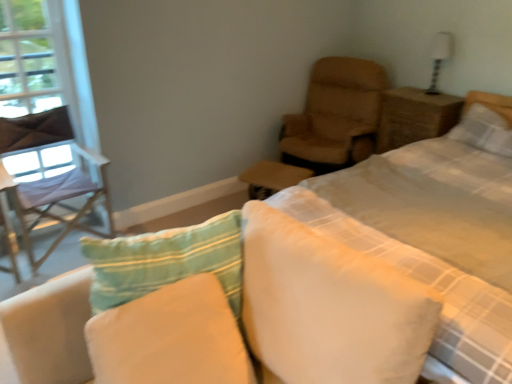
Question: Can leather-like tan chair at upper right, the first chair in the right-to-left sequence, be found inside soft cotton pillow at center, the third pillow when ordered from top to bottom?

Choices:
 (A) no
 (B) yes

Answer: (A)

Question: Is soft cotton pillow at center, which ranks as the first pillow in front-to-back order, positioned before leather-like tan chair at upper right, the second chair in the left-to-right sequence?

Choices:
 (A) no
 (B) yes

Answer: (B)

Question: Does soft cotton pillow at center, which is the 3th pillow from right to left, have a lesser height compared to leather-like tan chair at upper right, the second chair in the left-to-right sequence?

Choices:
 (A) yes
 (B) no

Answer: (A)

Question: Does soft cotton pillow at center, which ranks as the first pillow in front-to-back order, appear on the left side of leather-like tan chair at upper right, the first chair in the right-to-left sequence?

Choices:
 (A) yes
 (B) no

Answer: (A)

Question: From a real-world perspective, is soft cotton pillow at center, the third pillow when ordered from top to bottom, below leather-like tan chair at upper right, the second chair in the left-to-right sequence?

Choices:
 (A) no
 (B) yes

Answer: (B)

Question: Is white textured pillow at upper right, the 1th pillow in the back-to-front sequence, bigger or smaller than white soft pillow at center, the 2th pillow from the back?

Choices:
 (A) small
 (B) big

Answer: (A)

Question: Is white textured pillow at upper right, the 1th pillow in the back-to-front sequence, in front of or behind white soft pillow at center, which ranks as the 2th pillow in bottom-to-top order, in the image?

Choices:
 (A) front
 (B) behind

Answer: (B)

Question: In the image, is white textured pillow at upper right, placed as the third pillow when sorted from left to right, on the left side or the right side of white soft pillow at center, positioned as the 2th pillow in front-to-back order?

Choices:
 (A) right
 (B) left

Answer: (A)

Question: From the image's perspective, is white textured pillow at upper right, the third pillow when ordered from bottom to top, above or below white soft pillow at center, the second pillow in the right-to-left sequence?

Choices:
 (A) below
 (B) above

Answer: (B)

Question: From a real-world perspective, is soft cotton pillow at center, marked as the third pillow in a back-to-front arrangement, positioned above or below brown wicker nightstand at upper right?

Choices:
 (A) above
 (B) below

Answer: (B)

Question: Choose the correct answer: Is soft cotton pillow at center, the first pillow positioned from the left, inside brown wicker nightstand at upper right or outside it?

Choices:
 (A) inside
 (B) outside

Answer: (B)

Question: From the image's perspective, is soft cotton pillow at center, the third pillow when ordered from top to bottom, located above or below brown wicker nightstand at upper right?

Choices:
 (A) above
 (B) below

Answer: (B)

Question: Based on their sizes in the image, would you say soft cotton pillow at center, the first pillow positioned from the left, is bigger or smaller than brown wicker nightstand at upper right?

Choices:
 (A) big
 (B) small

Answer: (B)

Question: Is soft cotton pillow at center, arranged as the first pillow when ordered from the bottom, inside or outside of white glossy table lamp at upper right?

Choices:
 (A) outside
 (B) inside

Answer: (A)

Question: From their relative heights in the image, would you say soft cotton pillow at center, the third pillow when ordered from top to bottom, is taller or shorter than white glossy table lamp at upper right?

Choices:
 (A) tall
 (B) short

Answer: (A)